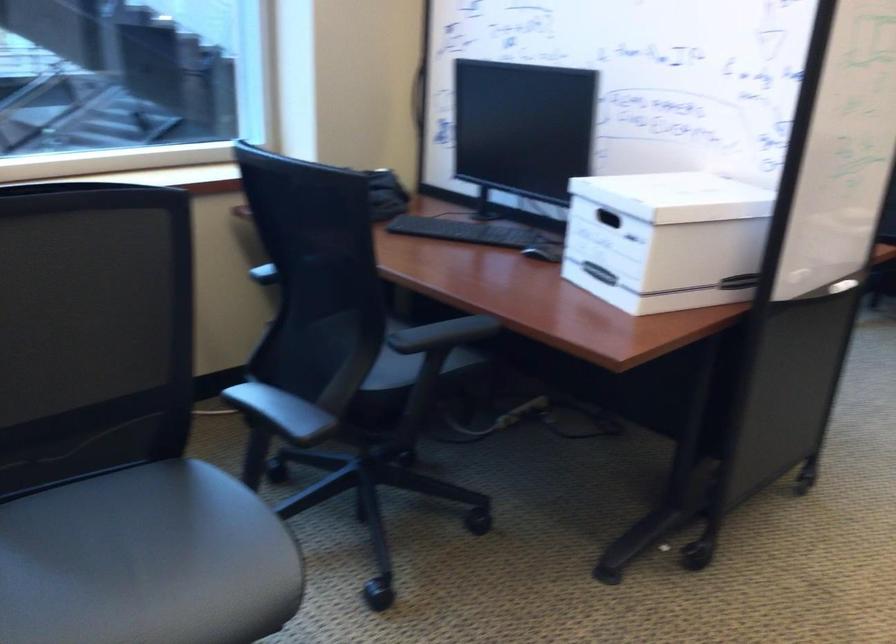
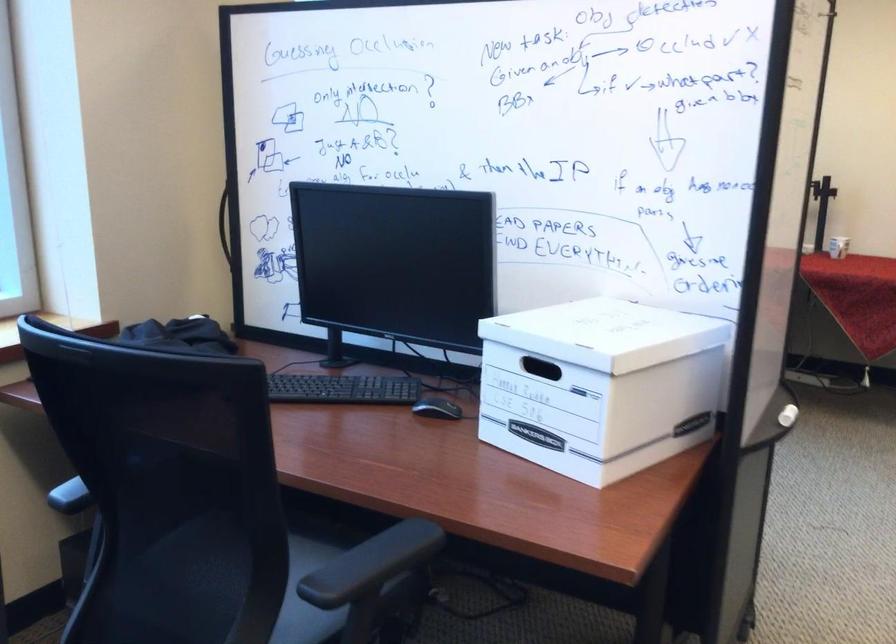
Question: The images are taken continuously from a first-person perspective. In which direction is your viewpoint rotating?

Choices:
 (A) Left
 (B) Right
 (C) Up
 (D) Down

Answer: (B)